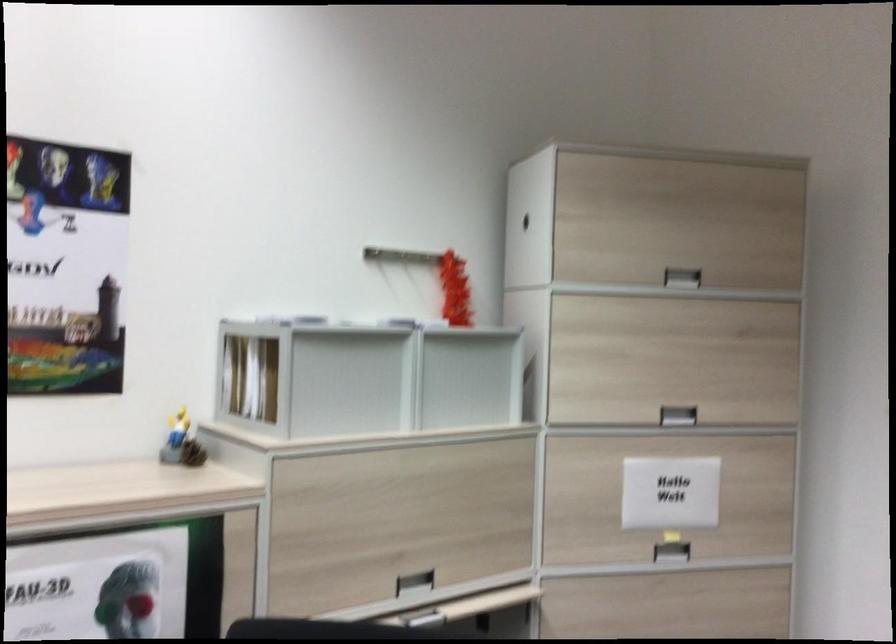
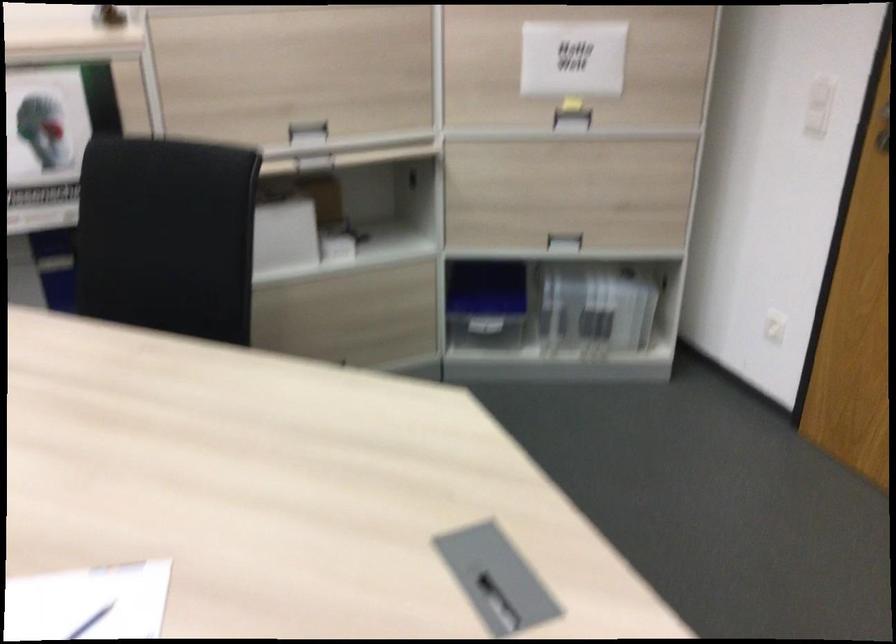
Find the pixel in the second image that matches point (410, 574) in the first image.

(307, 129)